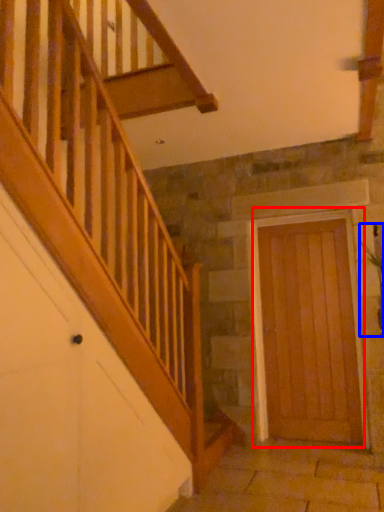
Question: Which of the following is the closest to the observer, door (highlighted by a red box) or plant (highlighted by a blue box)?

Choices:
 (A) door
 (B) plant

Answer: (B)